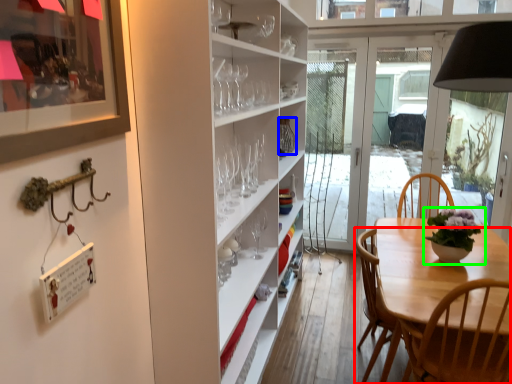
Question: Which object is positioned farthest from chair (highlighted by a red box)? Select from glass vase (highlighted by a blue box) and houseplant (highlighted by a green box).

Choices:
 (A) glass vase
 (B) houseplant

Answer: (A)